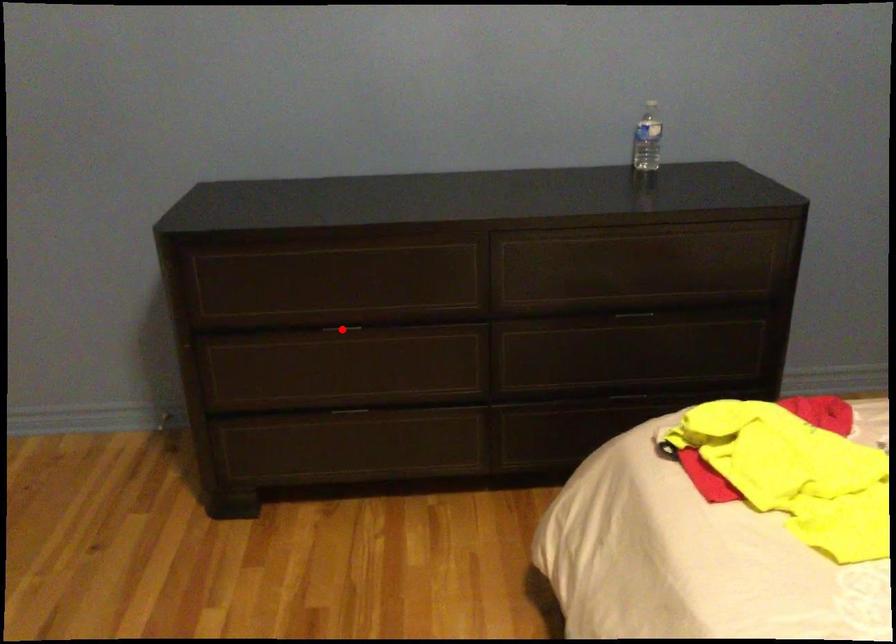
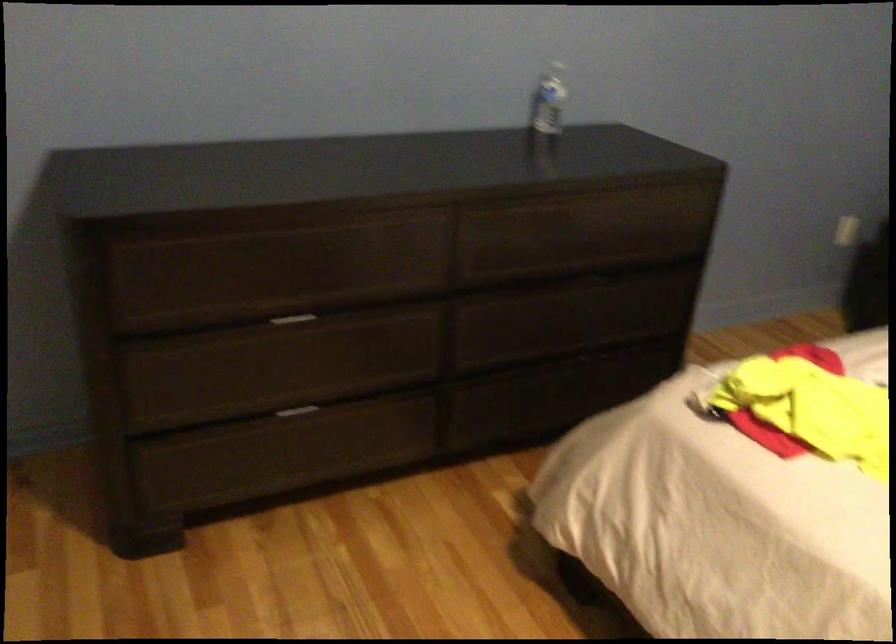
Question: I am providing you with two images of the same scene from different viewpoints. A red point is shown in image1. For the corresponding object point in image2, is it positioned nearer or farther from the camera?

Choices:
 (A) Nearer
 (B) Farther

Answer: (A)